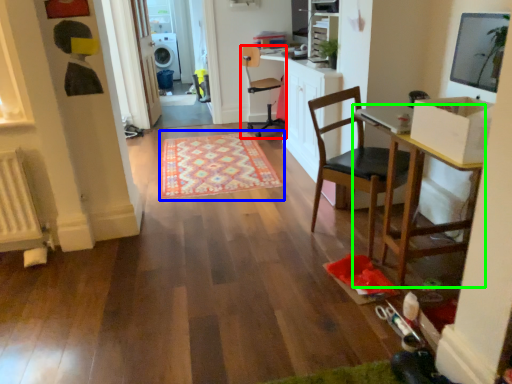
Question: Estimate the real-world distances between objects in this image. Which object is closer to chair (highlighted by a red box), mat (highlighted by a blue box) or table (highlighted by a green box)?

Choices:
 (A) mat
 (B) table

Answer: (A)